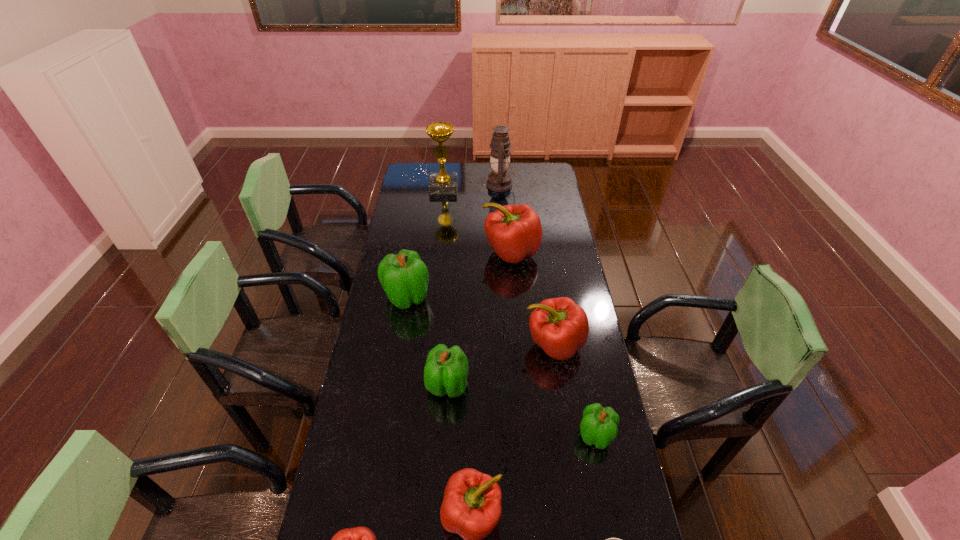
In order to click on award situated at the left edge in this screenshot , I will do `click(442, 182)`.

Find the location of a particular element. Image resolution: width=960 pixels, height=540 pixels. bell pepper located in the left edge section of the desktop is located at coordinates (404, 277).

This screenshot has height=540, width=960. I want to click on object that is at the far left corner, so click(x=442, y=182).

Find the location of a particular element. free space at the left edge of the desktop is located at coordinates (386, 325).

I want to click on free space at the right edge of the desktop, so point(579,417).

In the image, there is a desktop. Where is `free space at the far left corner`? The height and width of the screenshot is (540, 960). free space at the far left corner is located at coordinates (428, 181).

I want to click on vacant space at the far right corner of the desktop, so click(546, 185).

Find the location of a particular element. This screenshot has height=540, width=960. vacant space in between the second biggest pink bell pepper and the biggest pink bell pepper is located at coordinates (533, 299).

You are a GUI agent. You are given a task and a screenshot of the screen. Output one action in this format:
    pyautogui.click(x=<x>, y=<y>)
    Task: Click on the free space that is in between the third farthest object and the third smallest pink bell pepper
    This screenshot has height=540, width=960.
    Given the screenshot: What is the action you would take?
    pyautogui.click(x=533, y=299)

Find the location of a particular element. The image size is (960, 540). free space between the blue oil lamp and the fourth farthest object is located at coordinates (454, 241).